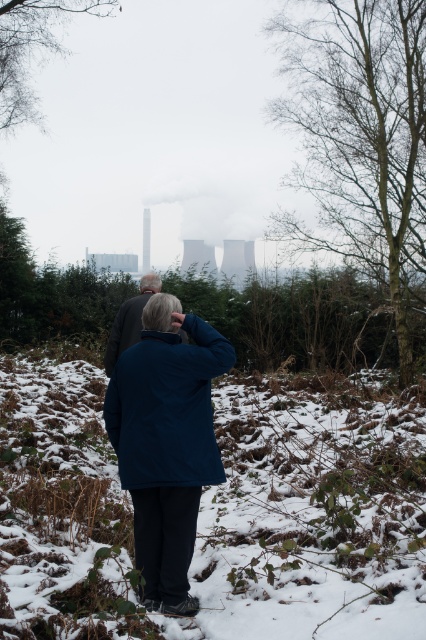
Who is taller, white fluffy snow at center or bare wood tree at right?

With more height is white fluffy snow at center.

Between white fluffy snow at center and bare wood tree at right, which one appears on the right side from the viewer's perspective?

bare wood tree at right is more to the right.

Who is more forward, [302,570] or [360,10]?

Point [302,570] is more forward.

Locate an element on the screen. white fluffy snow at center is located at coordinates (218, 509).

Does bare wood tree at right have a lesser height compared to dark blue jacket at center?

Yes.

Who is positioned more to the left, bare wood tree at right or dark blue jacket at center?

dark blue jacket at center is more to the left.

Find the location of a particular element. This screenshot has width=426, height=640. bare wood tree at right is located at coordinates (360, 138).

Is bare wood tree at right thinner than blue fabric jacket at center?

Indeed, bare wood tree at right has a lesser width compared to blue fabric jacket at center.

Is bare wood tree at right below blue fabric jacket at center?

Actually, bare wood tree at right is above blue fabric jacket at center.

Is point (379, 28) more distant than point (141, 440)?

Yes, it is behind point (141, 440).

The height and width of the screenshot is (640, 426). I want to click on bare wood tree at right, so click(360, 138).